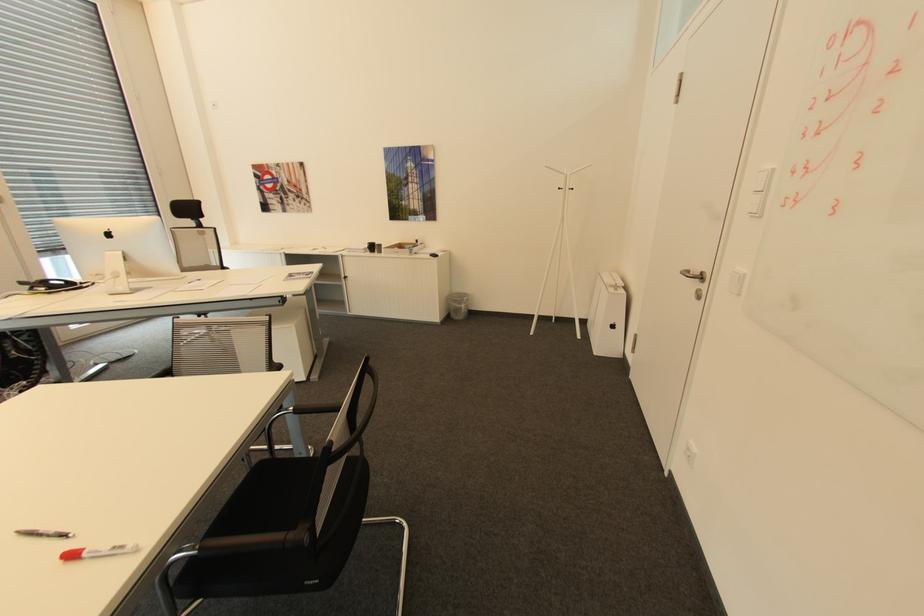
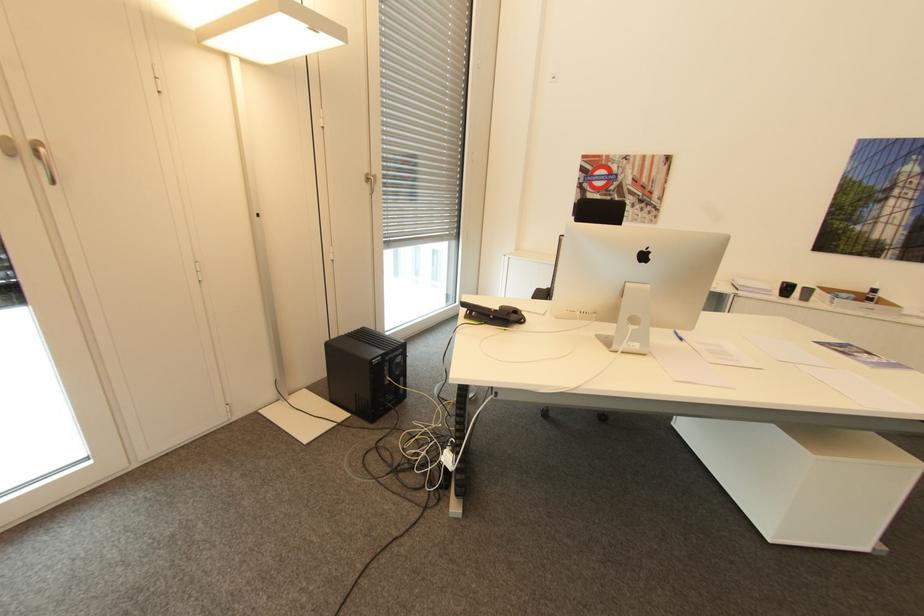
Find the pixel in the second image that matches point 420,240 in the first image.

(879, 290)